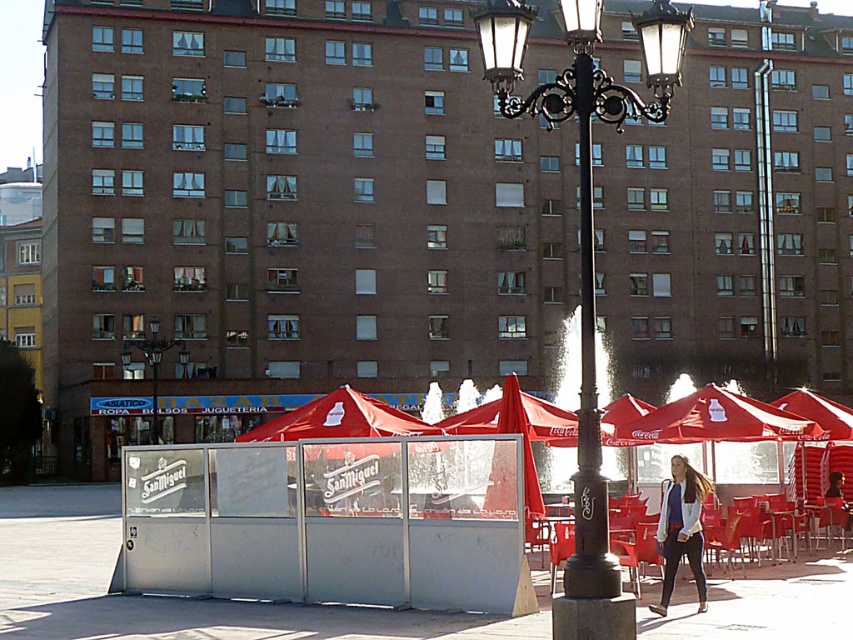
Can you confirm if black wrought iron street light at center is positioned above metallic street light at center?

Yes.

Who is more forward, (553,116) or (152,326)?

Point (553,116) is more forward.

The width and height of the screenshot is (853, 640). What are the coordinates of `black wrought iron street light at center` in the screenshot? It's located at (585, 252).

Between metallic silver pavement at lower center and metallic street light at center, which one has more height?

metallic street light at center is taller.

Can you confirm if metallic silver pavement at lower center is shorter than metallic street light at center?

Indeed, metallic silver pavement at lower center has a lesser height compared to metallic street light at center.

Is point (257, 627) positioned after point (134, 340)?

No.

The image size is (853, 640). I want to click on metallic silver pavement at lower center, so pos(167,596).

Is metallic silver pavement at lower center further to the viewer compared to bronze textured pole at center?

Yes, metallic silver pavement at lower center is behind bronze textured pole at center.

Is metallic silver pavement at lower center positioned before bronze textured pole at center?

No, metallic silver pavement at lower center is further to the viewer.

Where is `metallic silver pavement at lower center`? metallic silver pavement at lower center is located at coordinates tap(167, 596).

Image resolution: width=853 pixels, height=640 pixels. In order to click on metallic silver pavement at lower center in this screenshot , I will do 167,596.